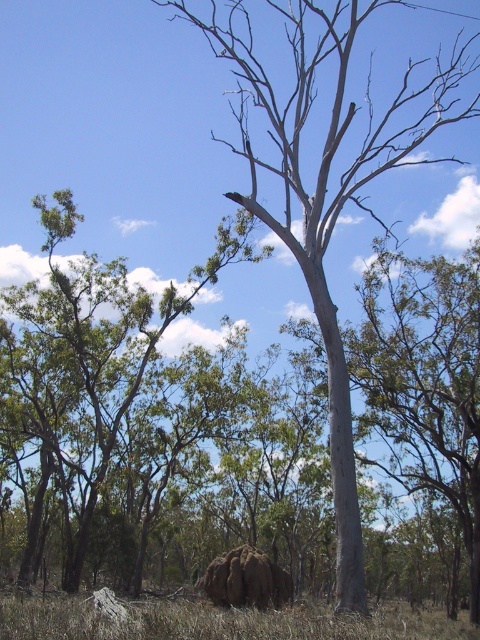
You are standing at the edge of the landscape and want to walk towards the gray bark tree at center. Which direction should you move relative to the brown dry grass at lower center?

The gray bark tree at center is to the right of the brown dry grass at lower center, so you should move to your right to reach it.